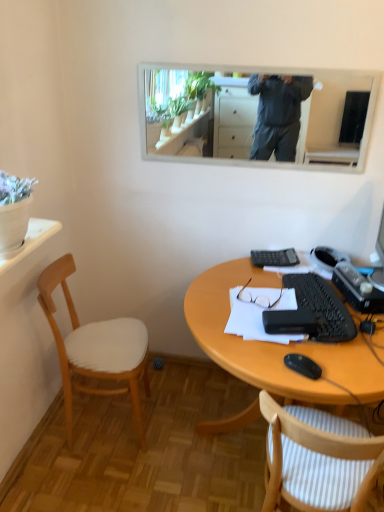
Question: Is black plastic mouse at lower right completely or partially outside of white striped fabric chair at lower right, which is the 1th chair from right to left?

Choices:
 (A) yes
 (B) no

Answer: (B)

Question: From the image's perspective, is black plastic mouse at lower right under white striped fabric chair at lower right, marked as the second chair in a left-to-right arrangement?

Choices:
 (A) yes
 (B) no

Answer: (B)

Question: Is black plastic mouse at lower right at the right side of white striped fabric chair at lower right, marked as the second chair in a left-to-right arrangement?

Choices:
 (A) no
 (B) yes

Answer: (A)

Question: Considering the relative positions of black plastic mouse at lower right and white striped fabric chair at lower right, which is the 1th chair from right to left, in the image provided, is black plastic mouse at lower right to the left of white striped fabric chair at lower right, which is the 1th chair from right to left, from the viewer's perspective?

Choices:
 (A) yes
 (B) no

Answer: (A)

Question: From a real-world perspective, is black plastic mouse at lower right under white striped fabric chair at lower right, which is the 1th chair from right to left?

Choices:
 (A) no
 (B) yes

Answer: (A)

Question: Are black plastic mouse at lower right and white striped fabric chair at lower right, marked as the second chair in a left-to-right arrangement, making contact?

Choices:
 (A) no
 (B) yes

Answer: (A)

Question: From a real-world perspective, is black plastic keyboard at center right beneath white paper at center?

Choices:
 (A) no
 (B) yes

Answer: (A)

Question: From the image's perspective, is black plastic keyboard at center right over white paper at center?

Choices:
 (A) no
 (B) yes

Answer: (B)

Question: Can you confirm if black plastic keyboard at center right is bigger than white paper at center?

Choices:
 (A) no
 (B) yes

Answer: (A)

Question: Can you confirm if black plastic keyboard at center right is smaller than white paper at center?

Choices:
 (A) yes
 (B) no

Answer: (A)

Question: Considering the relative positions of black plastic keyboard at center right and white paper at center in the image provided, is black plastic keyboard at center right to the left of white paper at center from the viewer's perspective?

Choices:
 (A) yes
 (B) no

Answer: (B)

Question: Does black plastic keyboard at center right have a lesser width compared to white paper at center?

Choices:
 (A) yes
 (B) no

Answer: (A)

Question: Can you confirm if white striped fabric chair at lower right, marked as the second chair in a left-to-right arrangement, is thinner than wooden desk at lower center?

Choices:
 (A) yes
 (B) no

Answer: (A)